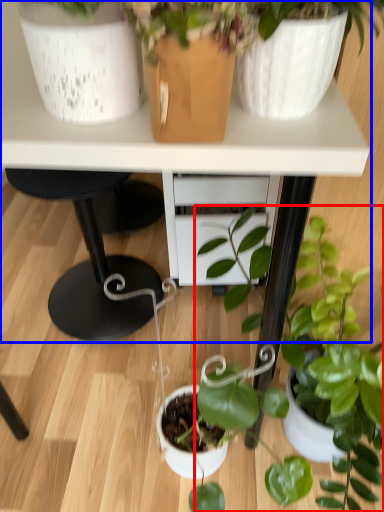
Question: Which of the following is the closest to the observer, houseplant (highlighted by a red box) or table (highlighted by a blue box)?

Choices:
 (A) houseplant
 (B) table

Answer: (A)